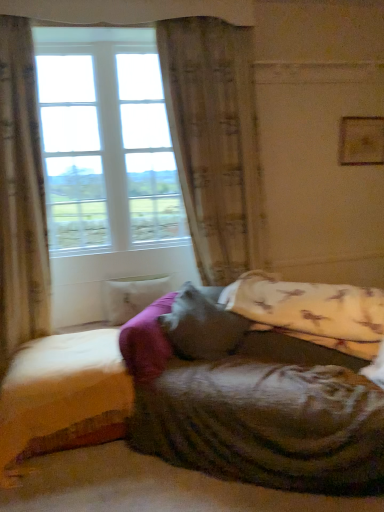
Question: Does beige textured curtain at center, which appears as the second curtain when viewed from the left, have a greater height compared to wooden bed frame at lower left?

Choices:
 (A) yes
 (B) no

Answer: (A)

Question: Does beige textured curtain at center, marked as the 1th curtain in a right-to-left arrangement, touch wooden bed frame at lower left?

Choices:
 (A) yes
 (B) no

Answer: (B)

Question: Can you confirm if beige textured curtain at center, marked as the 1th curtain in a right-to-left arrangement, is wider than wooden bed frame at lower left?

Choices:
 (A) yes
 (B) no

Answer: (B)

Question: Is beige textured curtain at center, marked as the 1th curtain in a right-to-left arrangement, thinner than wooden bed frame at lower left?

Choices:
 (A) yes
 (B) no

Answer: (A)

Question: Does beige textured curtain at center, which appears as the second curtain when viewed from the left, turn towards wooden bed frame at lower left?

Choices:
 (A) yes
 (B) no

Answer: (B)

Question: From the image's perspective, is clear glass window at upper left located above or below velvety gray pillow at center, the 1th pillow from the front?

Choices:
 (A) below
 (B) above

Answer: (B)

Question: Considering the positions of clear glass window at upper left and velvety gray pillow at center, which appears as the 2th pillow when viewed from the back, in the image, is clear glass window at upper left bigger or smaller than velvety gray pillow at center, which appears as the 2th pillow when viewed from the back,?

Choices:
 (A) small
 (B) big

Answer: (B)

Question: From a real-world perspective, is clear glass window at upper left above or below velvety gray pillow at center, which is counted as the 1th pillow, starting from the right?

Choices:
 (A) above
 (B) below

Answer: (A)

Question: Considering their positions, is clear glass window at upper left located in front of or behind velvety gray pillow at center, which is the 2th pillow in left-to-right order?

Choices:
 (A) behind
 (B) front

Answer: (A)

Question: From the image's perspective, relative to wooden bed frame at lower left, is white marble pillow at center, the first pillow when ordered from back to front, above or below?

Choices:
 (A) above
 (B) below

Answer: (A)

Question: Considering the positions of white marble pillow at center, the 1th pillow positioned from the left, and wooden bed frame at lower left in the image, is white marble pillow at center, the 1th pillow positioned from the left, wider or thinner than wooden bed frame at lower left?

Choices:
 (A) thin
 (B) wide

Answer: (A)

Question: Visually, is white marble pillow at center, the first pillow when ordered from back to front, positioned to the left or to the right of wooden bed frame at lower left?

Choices:
 (A) left
 (B) right

Answer: (B)

Question: Looking at the image, does white marble pillow at center, placed as the second pillow when sorted from right to left, seem bigger or smaller compared to wooden bed frame at lower left?

Choices:
 (A) big
 (B) small

Answer: (B)

Question: Is wooden bed frame at lower left spatially inside beige textured curtain at left, acting as the first curtain starting from the left, or outside of it?

Choices:
 (A) outside
 (B) inside

Answer: (A)

Question: In the image, is wooden bed frame at lower left on the left side or the right side of beige textured curtain at left, placed as the second curtain when sorted from right to left?

Choices:
 (A) right
 (B) left

Answer: (A)